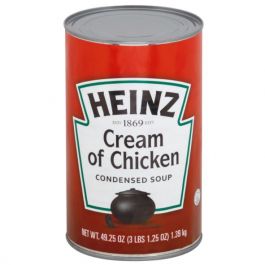
The height and width of the screenshot is (265, 265). Find the location of `pot`. pot is located at coordinates (137, 208).